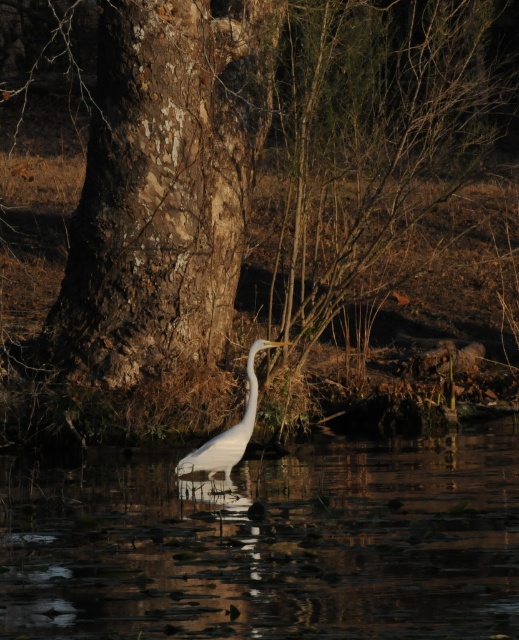
Question: Among these points, which one is farthest from the camera?

Choices:
 (A) (184, 291)
 (B) (418, 474)
 (C) (216, 456)
 (D) (307, 417)

Answer: (D)

Question: Is brown rough tree trunk at center positioned behind rough bark tree trunk at center?

Choices:
 (A) no
 (B) yes

Answer: (A)

Question: Which point is farther from the camera taking this photo?

Choices:
 (A) (193, 467)
 (B) (509, 529)
 (C) (285, 404)
 (D) (218, 353)

Answer: (D)

Question: Can you confirm if rough bark tree trunk at center is smaller than white smooth heron at center?

Choices:
 (A) yes
 (B) no

Answer: (B)

Question: Does clear water at center have a lesser width compared to white smooth heron at center?

Choices:
 (A) yes
 (B) no

Answer: (A)

Question: Based on their relative distances, which object is nearer to the clear water at center?

Choices:
 (A) white smooth heron at center
 (B) rough bark tree trunk at center
 (C) brown rough tree trunk at center

Answer: (A)